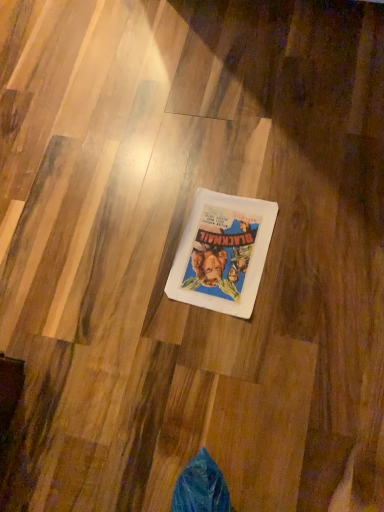
I want to click on free space on the front side of white matte book cover at center, so click(256, 351).